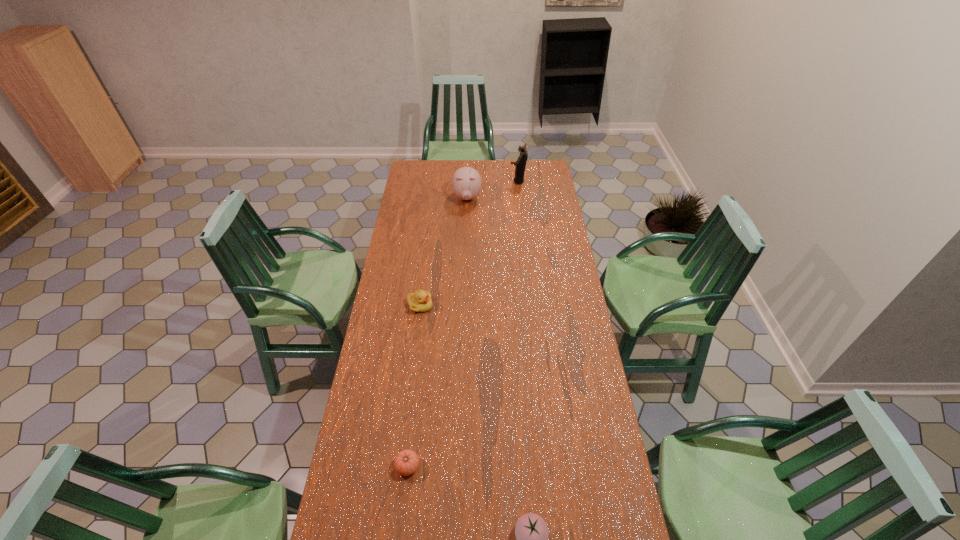
This screenshot has height=540, width=960. Find the location of `free space between the second nearest object and the duckling`. free space between the second nearest object and the duckling is located at coordinates [x=414, y=386].

The image size is (960, 540). I want to click on free spot between the figurine and the piggy bank, so click(492, 190).

This screenshot has height=540, width=960. In order to click on free space between the duckling and the tallest object in this screenshot , I will do `click(468, 244)`.

Locate an element on the screen. object that is the third nearest to the duckling is located at coordinates (531, 531).

Identify which object is located as the second nearest to the figurine. Please provide its 2D coordinates. Your answer should be formatted as a tuple, i.e. [(x, y)], where the tuple contains the x and y coordinates of a point satisfying the conditions above.

[(420, 301)]

Identify the location of vacant point that satisfies the following two spatial constraints: 1. on the front-facing side of the duckling; 2. on the left side of the shorter tomato. This screenshot has height=540, width=960. (399, 467).

Find the location of `vacant space that satisfies the following two spatial constraints: 1. on the front-facing side of the left tomato; 2. on the left side of the duckling`. vacant space that satisfies the following two spatial constraints: 1. on the front-facing side of the left tomato; 2. on the left side of the duckling is located at coordinates (399, 467).

What are the coordinates of `free space that satisfies the following two spatial constraints: 1. on the front-facing side of the tallest object; 2. on the front side of the second nearest object` in the screenshot? It's located at (549, 467).